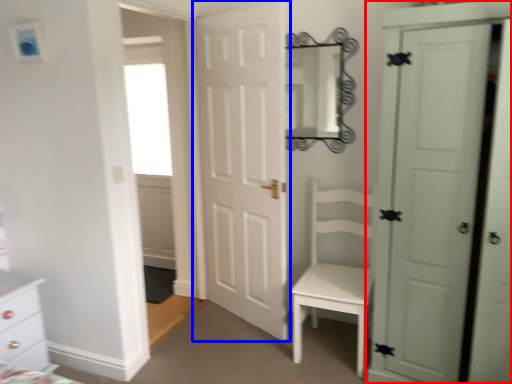
Question: Among these objects, which one is farthest to the camera, door (highlighted by a red box) or door (highlighted by a blue box)?

Choices:
 (A) door
 (B) door

Answer: (B)